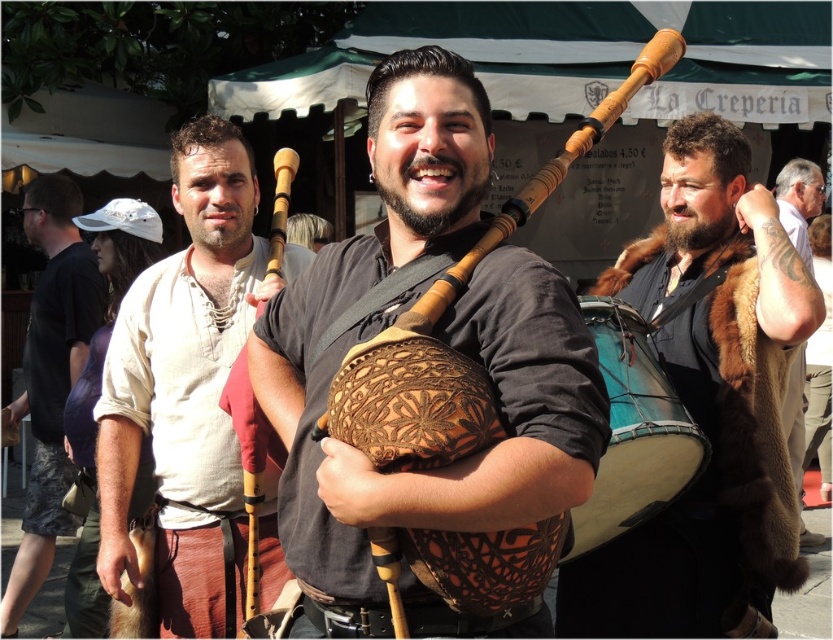
Please answer based on the scene description and the provided coordinates. What object is located at the coordinates point (437, 337)?

The brown leather bagpipe at center is located at point (437, 337).

You are a photographer setting up for a group photo. You notice the brown fur coat at right and the blue leather drum at right are both on the right side of the scene. Which one is covering part of the other?

The brown fur coat at right is positioned over the blue leather drum at right, so it is covering part of it.

You are a music enthusiast observing the two bagpipes in the scene. Which bagpipe, the brown leather bagpipe at center or the wooden bagpipe at center, is located to the right of the other?

The brown leather bagpipe at center is positioned on the right side of wooden bagpipe at center.